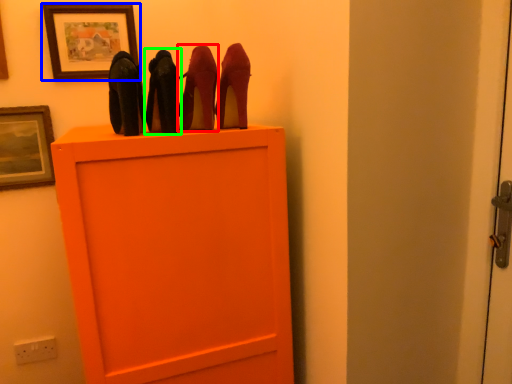
Question: Estimate the real-world distances between objects in this image. Which object is closer to high heels (highlighted by a red box), picture frame (highlighted by a blue box) or high heels (highlighted by a green box)?

Choices:
 (A) picture frame
 (B) high heels

Answer: (B)